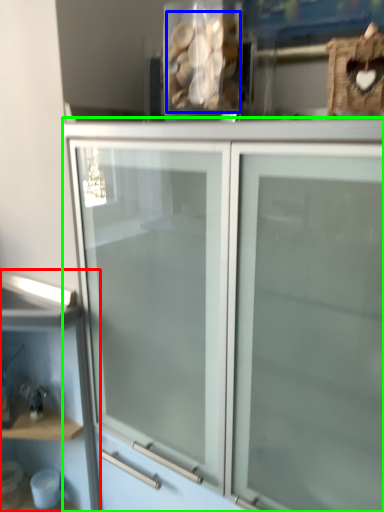
Question: Estimate the real-world distances between objects in this image. Which object is farther from shelf (highlighted by a red box), stuff (highlighted by a blue box) or cupboard (highlighted by a green box)?

Choices:
 (A) stuff
 (B) cupboard

Answer: (A)